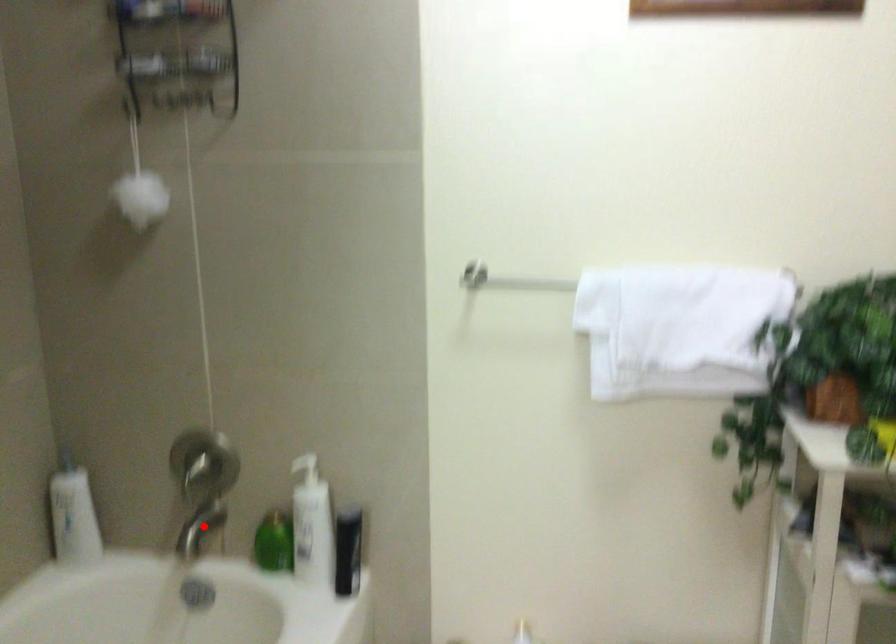
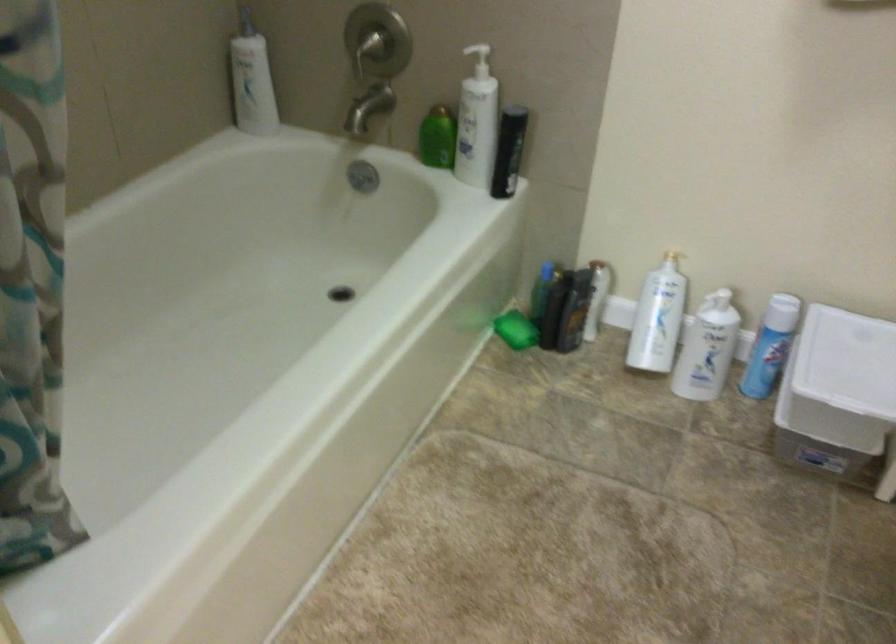
In the second image, find the point that corresponds to the highlighted location in the first image.

(368, 108)